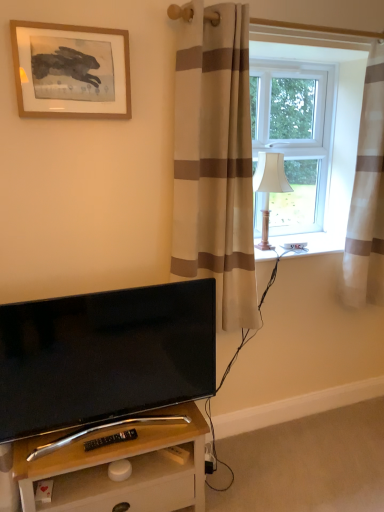
Question: In the image, is white fabric lampshade at right positioned in front of or behind wooden frame at upper left?

Choices:
 (A) behind
 (B) front

Answer: (A)

Question: From the image's perspective, is white fabric lampshade at right above or below wooden frame at upper left?

Choices:
 (A) below
 (B) above

Answer: (A)

Question: Estimate the real-world distances between objects in this image. Which object is closer to the black plastic remote control at lower center?

Choices:
 (A) white fabric lampshade at right
 (B) wooden frame at upper left
 (C) black glossy tv at lower left
 (D) beige striped curtain at right, the 2th curtain viewed from the left
 (E) beige striped curtain at center, placed as the 1th curtain when sorted from left to right

Answer: (C)

Question: Which object is positioned farthest from the transparent glass window at upper right?

Choices:
 (A) wooden desk at lower center
 (B) black glossy tv at lower left
 (C) black plastic remote control at lower center
 (D) white fabric lampshade at right
 (E) beige striped curtain at center, positioned as the second curtain in right-to-left order

Answer: (C)